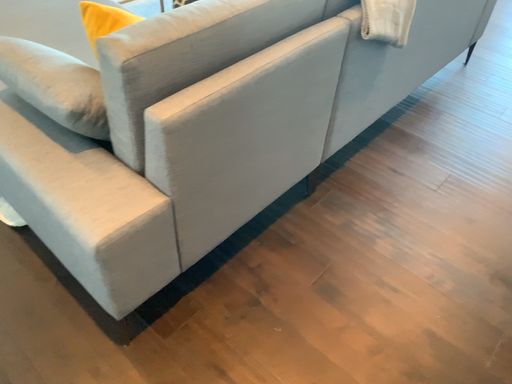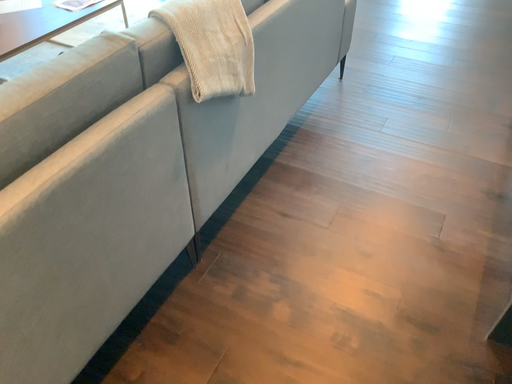
Question: How did the camera likely rotate when shooting the video?

Choices:
 (A) rotated right
 (B) rotated left

Answer: (A)